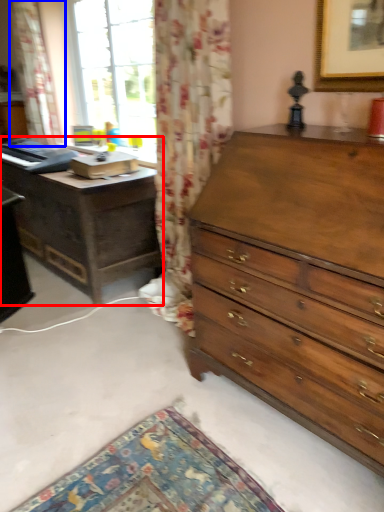
Question: Among these objects, which one is nearest to the camera, nightstand (highlighted by a red box) or curtain (highlighted by a blue box)?

Choices:
 (A) nightstand
 (B) curtain

Answer: (A)